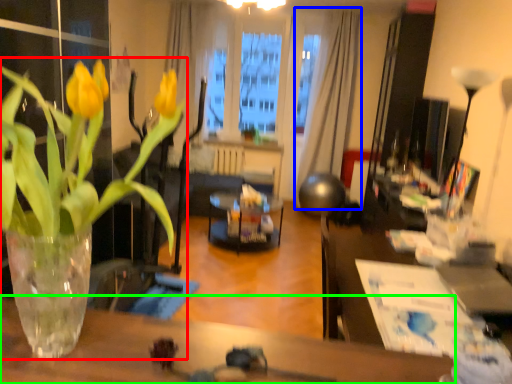
Question: Which is farther away from houseplant (highlighted by a red box)? curtain (highlighted by a blue box) or table (highlighted by a green box)?

Choices:
 (A) curtain
 (B) table

Answer: (A)